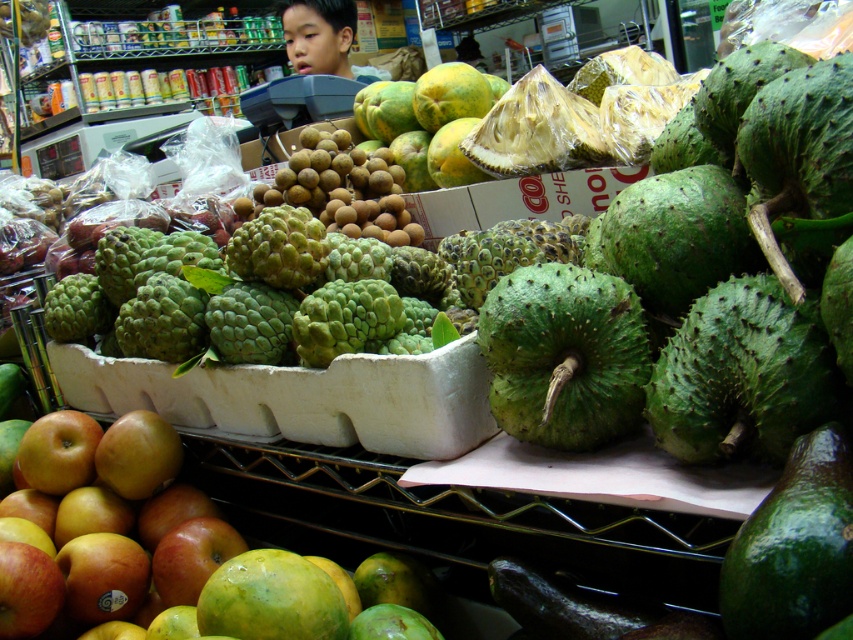
Can you confirm if green matte avocado at lower right is wider than smooth skin boy at upper center?

In fact, green matte avocado at lower right might be narrower than smooth skin boy at upper center.

Can you confirm if green matte avocado at lower right is positioned to the right of smooth skin boy at upper center?

Indeed, green matte avocado at lower right is positioned on the right side of smooth skin boy at upper center.

What do you see at coordinates (793, 547) in the screenshot? The width and height of the screenshot is (853, 640). I see `green matte avocado at lower right` at bounding box center [793, 547].

Find the location of a particular element. green matte avocado at lower right is located at coordinates (793, 547).

You are a GUI agent. You are given a task and a screenshot of the screen. Output one action in this format:
    pyautogui.click(x=<x>, y=<y>)
    Task: Click on the reddish-yellow smooth apple at lower left
    Image resolution: width=853 pixels, height=640 pixels.
    Given the screenshot: What is the action you would take?
    pyautogui.click(x=103, y=525)

Find the location of a particular element. reddish-yellow smooth apple at lower left is located at coordinates (103, 525).

In order to click on reddish-yellow smooth apple at lower left in this screenshot , I will do `click(103, 525)`.

Who is more forward, (10,545) or (846,554)?

Point (846,554) is more forward.

Locate an element on the screen. The width and height of the screenshot is (853, 640). reddish-yellow smooth apple at lower left is located at coordinates (103, 525).